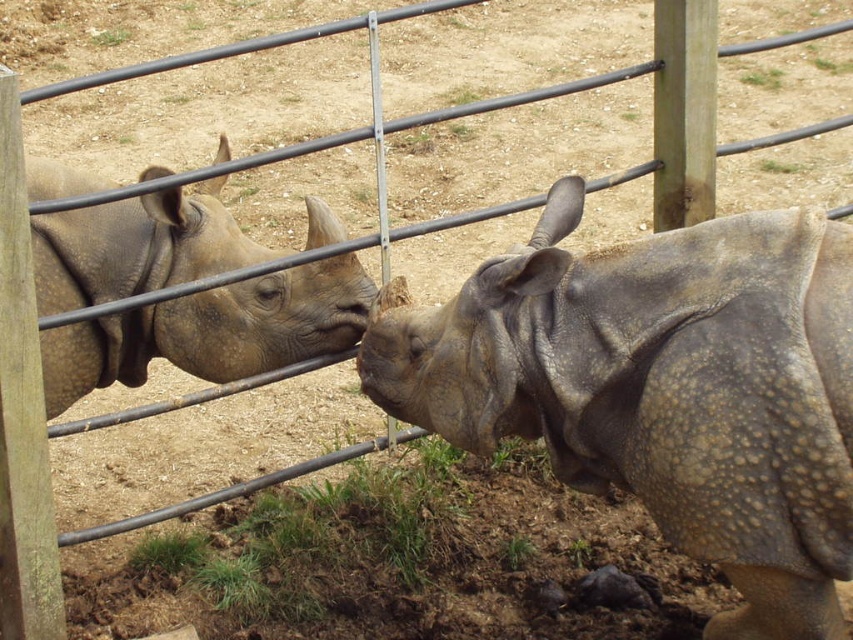
Question: Can you confirm if leathery gray rhino at center is wider than matte gray rhino at left?

Choices:
 (A) no
 (B) yes

Answer: (B)

Question: Can you confirm if leathery gray rhino at center is positioned to the right of matte gray rhino at left?

Choices:
 (A) yes
 (B) no

Answer: (A)

Question: Which point appears farthest from the camera in this image?

Choices:
 (A) (466, 358)
 (B) (67, 362)

Answer: (B)

Question: Which object appears farthest from the camera in this image?

Choices:
 (A) leathery gray rhino at center
 (B) matte gray rhino at left

Answer: (B)

Question: Where is leathery gray rhino at center located in relation to matte gray rhino at left in the image?

Choices:
 (A) left
 (B) right

Answer: (B)